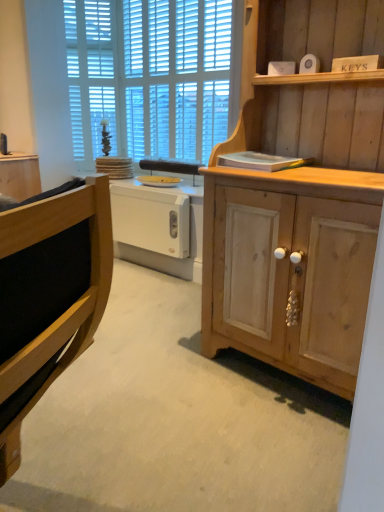
Question: Can you confirm if wooden cabinet at left, which is the second cabinetry from front to back, is positioned to the right of white plastic radiator at center?

Choices:
 (A) yes
 (B) no

Answer: (B)

Question: Considering the relative sizes of wooden cabinet at left, arranged as the 1th cabinetry when viewed from the back, and white plastic radiator at center in the image provided, is wooden cabinet at left, arranged as the 1th cabinetry when viewed from the back, smaller than white plastic radiator at center?

Choices:
 (A) yes
 (B) no

Answer: (B)

Question: Is wooden cabinet at left, which ranks as the first cabinetry in left-to-right order, closer to the viewer compared to white plastic radiator at center?

Choices:
 (A) yes
 (B) no

Answer: (B)

Question: Is white plastic radiator at center inside wooden cabinet at left, which is the second cabinetry from front to back?

Choices:
 (A) yes
 (B) no

Answer: (B)

Question: From a real-world perspective, is wooden cabinet at left, which appears as the 2th cabinetry when viewed from the right, located higher than white plastic radiator at center?

Choices:
 (A) yes
 (B) no

Answer: (B)

Question: Does wooden cabinet at left, which appears as the 2th cabinetry when viewed from the right, have a greater width compared to white plastic radiator at center?

Choices:
 (A) no
 (B) yes

Answer: (B)

Question: Is natural wood cabinet at right, the 2th cabinetry from the back, further to the viewer compared to white wooden blinds at upper center?

Choices:
 (A) yes
 (B) no

Answer: (B)

Question: From the image's perspective, does natural wood cabinet at right, the 2th cabinetry from the back, appear lower than white wooden blinds at upper center?

Choices:
 (A) yes
 (B) no

Answer: (A)

Question: Can you confirm if natural wood cabinet at right, the 1th cabinetry when ordered from front to back, is positioned to the left of white wooden blinds at upper center?

Choices:
 (A) yes
 (B) no

Answer: (B)

Question: Is natural wood cabinet at right, the first cabinetry when ordered from right to left, far away from white wooden blinds at upper center?

Choices:
 (A) no
 (B) yes

Answer: (B)

Question: Does natural wood cabinet at right, the first cabinetry when ordered from right to left, have a greater width compared to white wooden blinds at upper center?

Choices:
 (A) no
 (B) yes

Answer: (B)

Question: Is natural wood cabinet at right, the 1th cabinetry when ordered from front to back, bigger than white wooden blinds at upper center?

Choices:
 (A) yes
 (B) no

Answer: (A)

Question: Is white plastic drawer at center shorter than wooden cabinet at left, arranged as the 1th cabinetry when viewed from the back?

Choices:
 (A) no
 (B) yes

Answer: (A)